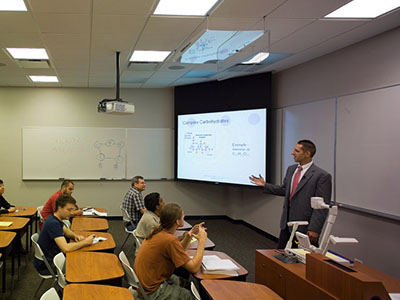
Locate an element on the screen. The width and height of the screenshot is (400, 300). light is located at coordinates (15, 4), (24, 52), (45, 77), (151, 57), (186, 5), (259, 59), (358, 5).